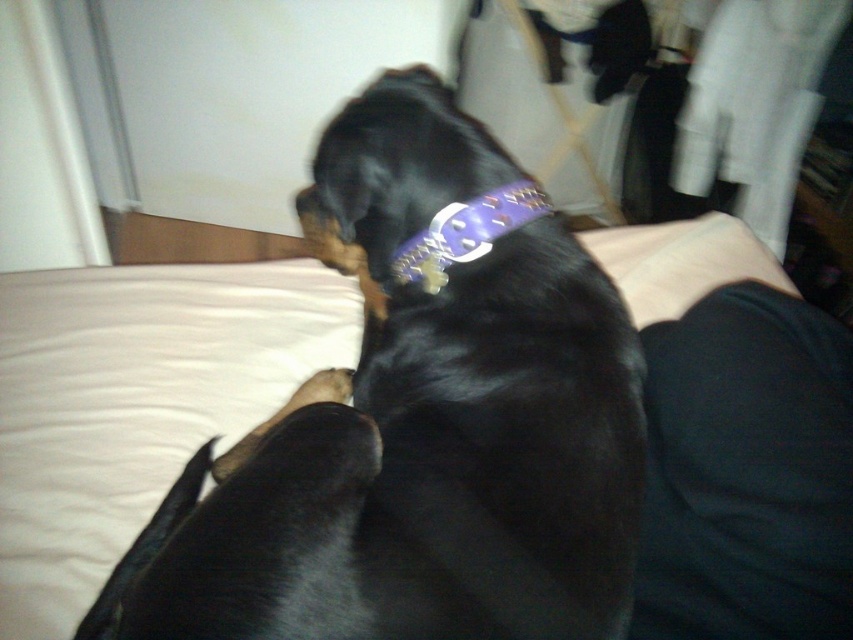
From the picture: You are a photographer setting up a tripod in the corner of the room. You want to place the tripod so that it doesn not block the view of the dark fabric pants at lower right. Where should you avoid placing the tripod?

You should avoid placing the tripod near the lower right corner of the room, specifically around the coordinates point (746, 472), to prevent blocking the view of the dark fabric pants at lower right.

Looking at the scene, which object is wider between the black shiny fur dog at center and the dark fabric pants at lower right?

The black shiny fur dog at center is wider than the dark fabric pants at lower right.